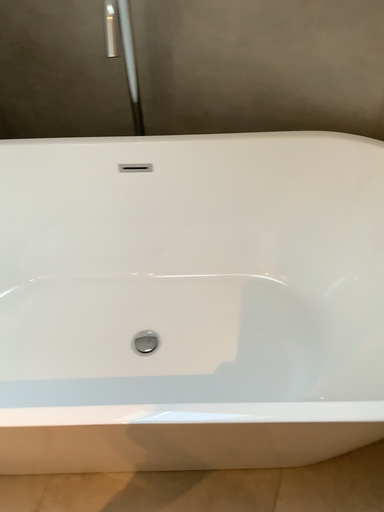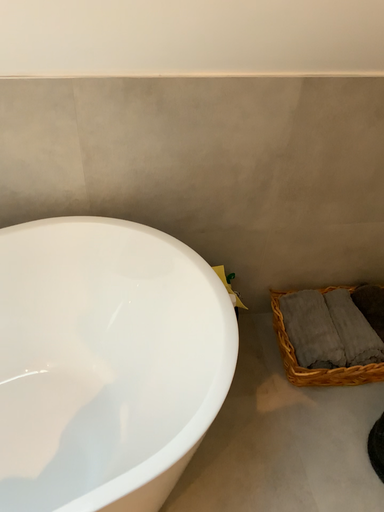
Question: Which way did the camera rotate in the video?

Choices:
 (A) rotated left
 (B) rotated right

Answer: (B)